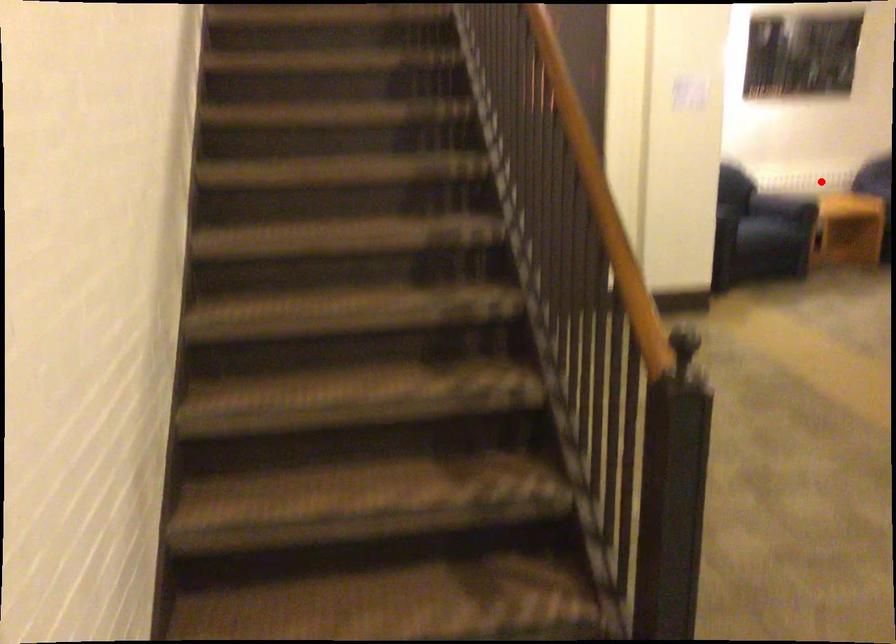
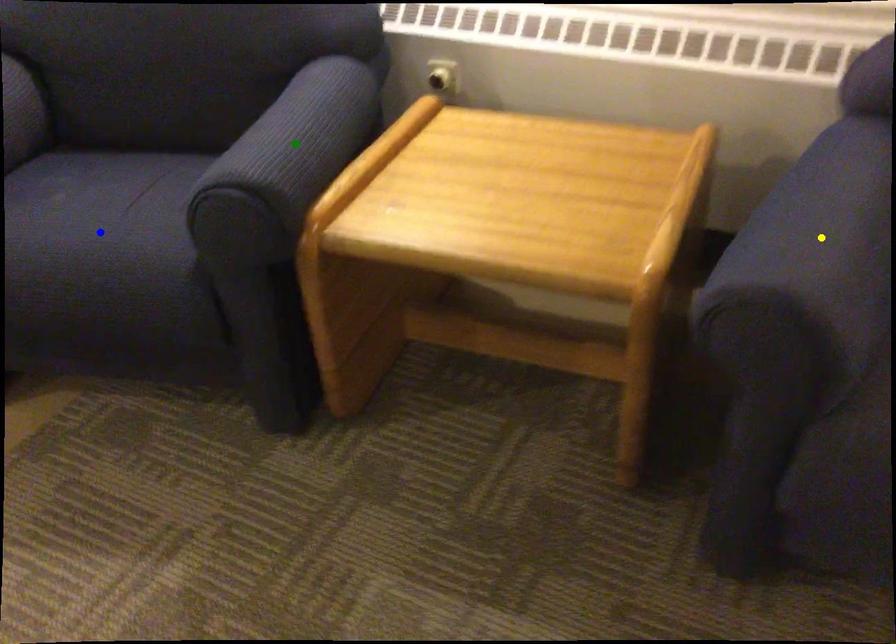
Question: I am providing you with two images of the same scene from different viewpoints. A red point is marked on the first image. You are given multiple points on the second image. Which spot in image 2 lines up with the point in image 1?

Choices:
 (A) green point
 (B) blue point
 (C) yellow point

Answer: (A)